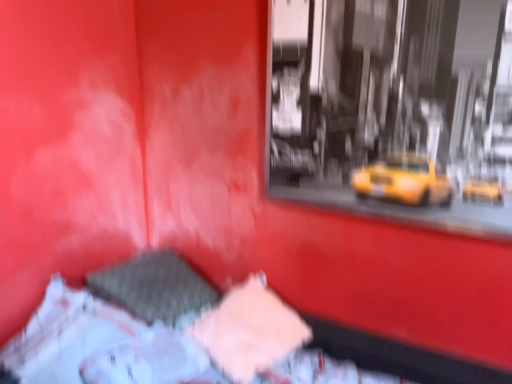
Question: Is pink fabric at center surrounded by textured fabric bed at center?

Choices:
 (A) yes
 (B) no

Answer: (A)

Question: Is textured fabric bed at center positioned with its back to pink fabric at center?

Choices:
 (A) no
 (B) yes

Answer: (B)

Question: From a real-world perspective, is textured fabric bed at center under pink fabric at center?

Choices:
 (A) yes
 (B) no

Answer: (B)

Question: Can you confirm if textured fabric bed at center is smaller than pink fabric at center?

Choices:
 (A) no
 (B) yes

Answer: (A)

Question: Is textured fabric bed at center not close to pink fabric at center?

Choices:
 (A) no
 (B) yes

Answer: (A)

Question: Does textured fabric bed at center have a greater width compared to pink fabric at center?

Choices:
 (A) no
 (B) yes

Answer: (B)

Question: From the image's perspective, would you say pink fabric at center is positioned over textured fabric bed at center?

Choices:
 (A) no
 (B) yes

Answer: (B)

Question: Does pink fabric at center have a greater width compared to textured fabric bed at center?

Choices:
 (A) no
 (B) yes

Answer: (A)

Question: Is pink fabric at center positioned before textured fabric bed at center?

Choices:
 (A) yes
 (B) no

Answer: (B)

Question: Is pink fabric at center positioned beyond the bounds of textured fabric bed at center?

Choices:
 (A) yes
 (B) no

Answer: (B)

Question: Is pink fabric at center not near textured fabric bed at center?

Choices:
 (A) no
 (B) yes

Answer: (A)

Question: Considering the relative positions of pink fabric at center and textured fabric bed at center in the image provided, is pink fabric at center to the left of textured fabric bed at center from the viewer's perspective?

Choices:
 (A) no
 (B) yes

Answer: (A)

Question: From the image's perspective, is textured fabric bed at center positioned above or below pink fabric at center?

Choices:
 (A) below
 (B) above

Answer: (A)